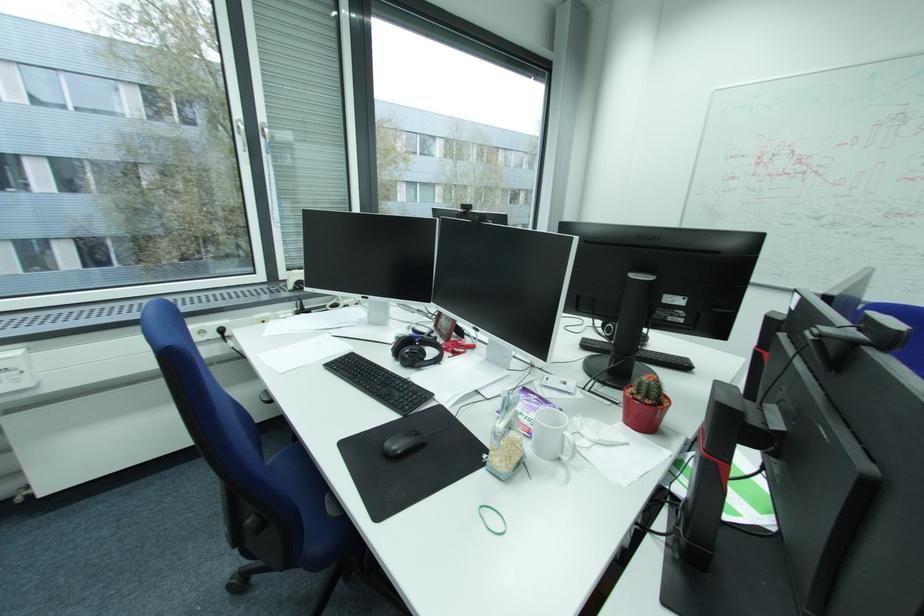
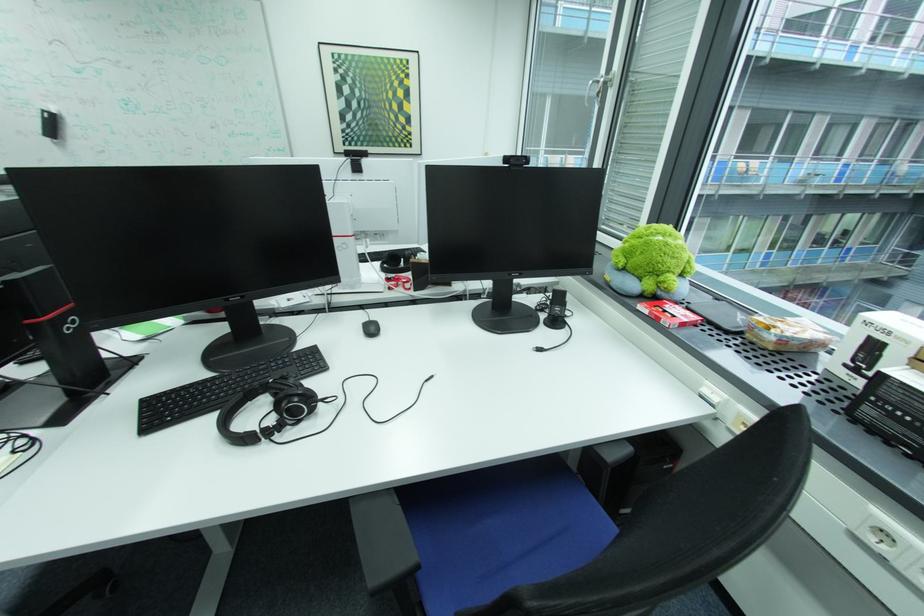
Question: I am providing you with two images of the same scene from different viewpoints. Which of the following objects are not visible in image2?

Choices:
 (A) red mug handle
 (B) plastic bag of grains
 (C) black chair armrest
 (D) cream drawer handle

Answer: (B)